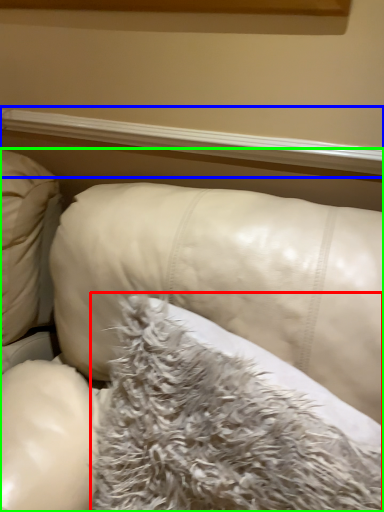
Question: Based on their relative distances, which object is farther from pillow (highlighted by a red box)? Choose from window sill (highlighted by a blue box) and furniture (highlighted by a green box).

Choices:
 (A) window sill
 (B) furniture

Answer: (A)